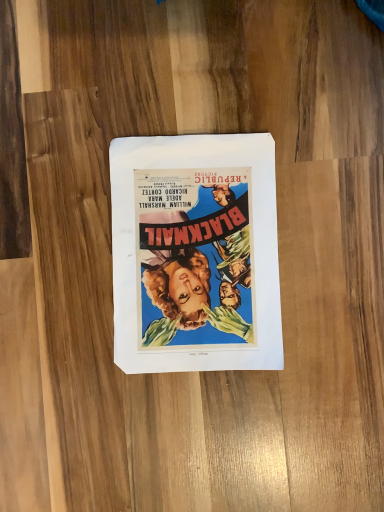
Where is `matte paper poster at center`? This screenshot has width=384, height=512. matte paper poster at center is located at coordinates (195, 253).

The image size is (384, 512). What do you see at coordinates (195, 253) in the screenshot?
I see `matte paper poster at center` at bounding box center [195, 253].

Find the location of a particular element. The width and height of the screenshot is (384, 512). matte paper poster at center is located at coordinates (195, 253).